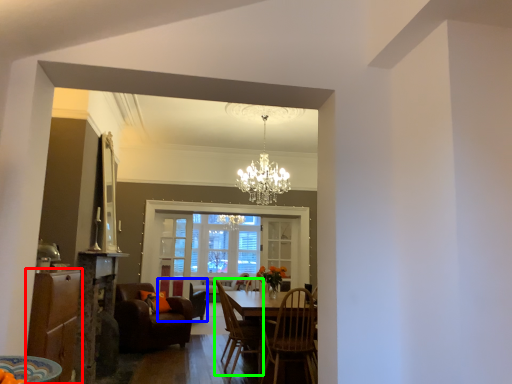
Question: Which object is the closest to the cabinetry (highlighted by a red box)? Choose among these: chair (highlighted by a blue box) or chair (highlighted by a green box).

Choices:
 (A) chair
 (B) chair

Answer: (B)